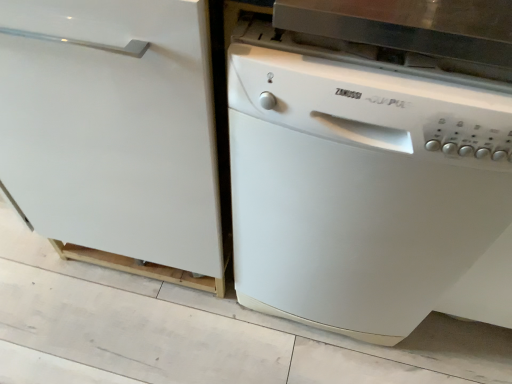
Find the location of `white matte dishwasher at right`. white matte dishwasher at right is located at coordinates (367, 195).

In order to face white matte dishwasher at right, should I rotate leftwards or rightwards?

To align with it, rotate right about 13.536°.

The width and height of the screenshot is (512, 384). What do you see at coordinates (367, 195) in the screenshot?
I see `white matte dishwasher at right` at bounding box center [367, 195].

The height and width of the screenshot is (384, 512). Describe the element at coordinates (114, 134) in the screenshot. I see `white matte dishwasher at right` at that location.

Image resolution: width=512 pixels, height=384 pixels. In order to click on white matte dishwasher at right in this screenshot , I will do `click(114, 134)`.

Where is `white matte dishwasher at right`? This screenshot has width=512, height=384. white matte dishwasher at right is located at coordinates (367, 195).

Based on the photo, considering the relative positions of white matte dishwasher at right and white matte dishwasher at right in the image provided, is white matte dishwasher at right to the left of white matte dishwasher at right from the viewer's perspective?

Indeed, white matte dishwasher at right is positioned on the left side of white matte dishwasher at right.

Is white matte dishwasher at right further to camera compared to white matte dishwasher at right?

Yes, it is.

Is point (98, 189) behind point (383, 201)?

Yes, point (98, 189) is behind point (383, 201).

From the image's perspective, which object appears higher, white matte dishwasher at right or white matte dishwasher at right?

white matte dishwasher at right.

From a real-world perspective, is white matte dishwasher at right under white matte dishwasher at right?

No, from a real-world perspective, white matte dishwasher at right is not under white matte dishwasher at right.

Looking at their sizes, would you say white matte dishwasher at right is wider or thinner than white matte dishwasher at right?

Clearly, white matte dishwasher at right has more width compared to white matte dishwasher at right.

Does white matte dishwasher at right have a greater height compared to white matte dishwasher at right?

Correct, white matte dishwasher at right is much taller as white matte dishwasher at right.

Is white matte dishwasher at right smaller than white matte dishwasher at right?

No.

Consider the image. Is white matte dishwasher at right completely or partially outside of white matte dishwasher at right?

Indeed, white matte dishwasher at right is completely outside white matte dishwasher at right.

Is white matte dishwasher at right next to white matte dishwasher at right and touching it?

No, white matte dishwasher at right is not touching white matte dishwasher at right.

Is white matte dishwasher at right facing away from white matte dishwasher at right?

No, white matte dishwasher at right is not facing the opposite direction of white matte dishwasher at right.

Image resolution: width=512 pixels, height=384 pixels. Find the location of `dish washer located on the right of white matte dishwasher at right`. dish washer located on the right of white matte dishwasher at right is located at coordinates (367, 195).

Does white matte dishwasher at right appear on the left side of white matte dishwasher at right?

Incorrect, white matte dishwasher at right is not on the left side of white matte dishwasher at right.

Is white matte dishwasher at right positioned in front of white matte dishwasher at right?

Yes, white matte dishwasher at right is in front of white matte dishwasher at right.

Considering the positions of point (231, 94) and point (191, 234), is point (231, 94) closer or farther from the camera than point (191, 234)?

Clearly, point (231, 94) is closer to the camera than point (191, 234).

From the image's perspective, is white matte dishwasher at right located above white matte dishwasher at right?

Incorrect, from the image's perspective, white matte dishwasher at right is lower than white matte dishwasher at right.

From a real-world perspective, between white matte dishwasher at right and white matte dishwasher at right, who is vertically higher?

white matte dishwasher at right is physically above.

Which object is thinner, white matte dishwasher at right or white matte dishwasher at right?

With smaller width is white matte dishwasher at right.

Which of these two, white matte dishwasher at right or white matte dishwasher at right, stands taller?

white matte dishwasher at right is taller.

Based on their sizes in the image, would you say white matte dishwasher at right is bigger or smaller than white matte dishwasher at right?

In the image, white matte dishwasher at right appears to be smaller than white matte dishwasher at right.

Is white matte dishwasher at right inside white matte dishwasher at right?

No, white matte dishwasher at right is not surrounded by white matte dishwasher at right.

Does white matte dishwasher at right touch white matte dishwasher at right?

There is a gap between white matte dishwasher at right and white matte dishwasher at right.

In the scene shown: Is white matte dishwasher at right oriented away from white matte dishwasher at right?

No, white matte dishwasher at right is not facing the opposite direction of white matte dishwasher at right.

How many degrees apart are the facing directions of white matte dishwasher at right and white matte dishwasher at right?

They differ by 0.000226 degrees in their facing directions.

How much distance is there between white matte dishwasher at right and white matte dishwasher at right?

They are 10.45 inches apart.

Locate an element on the screen. The width and height of the screenshot is (512, 384). dish washer below the white matte dishwasher at right (from a real-world perspective) is located at coordinates (367, 195).

Where is `dish washer to the right of white matte dishwasher at right`? dish washer to the right of white matte dishwasher at right is located at coordinates (367, 195).

Find the location of a particular element. This screenshot has height=384, width=512. home appliance behind the white matte dishwasher at right is located at coordinates (114, 134).